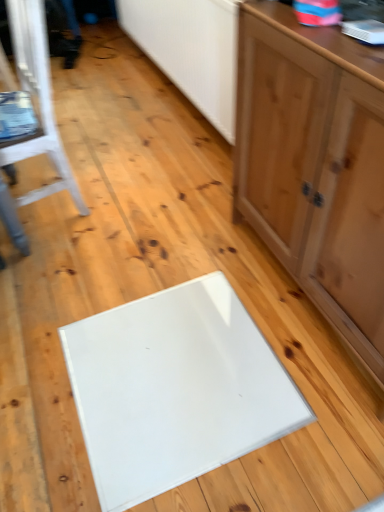
Describe the element at coordinates (315, 165) in the screenshot. The width and height of the screenshot is (384, 512). I see `matte wood cabinet at right` at that location.

The height and width of the screenshot is (512, 384). Identify the location of matte wood cabinet at right. (315, 165).

The height and width of the screenshot is (512, 384). Describe the element at coordinates (38, 101) in the screenshot. I see `white painted wood chair at left` at that location.

This screenshot has height=512, width=384. Identify the location of white painted wood chair at left. pos(38,101).

Where is `matte wood cabinet at right`? The height and width of the screenshot is (512, 384). matte wood cabinet at right is located at coordinates (315, 165).

Is white painted wood chair at left at the left side of matte wood cabinet at right?

Indeed, white painted wood chair at left is positioned on the left side of matte wood cabinet at right.

Which object is further away from the camera taking this photo, white painted wood chair at left or matte wood cabinet at right?

Positioned behind is white painted wood chair at left.

Between point (38, 30) and point (329, 248), which one is positioned behind?

The point (38, 30) is more distant.

Consider the image. From the image's perspective, which object appears higher, white painted wood chair at left or matte wood cabinet at right?

white painted wood chair at left, from the image's perspective.

From a real-world perspective, is white painted wood chair at left located beneath matte wood cabinet at right?

Yes, from a real-world perspective, white painted wood chair at left is under matte wood cabinet at right.

Which of these two, white painted wood chair at left or matte wood cabinet at right, is wider?

With larger width is white painted wood chair at left.

Does white painted wood chair at left have a greater height compared to matte wood cabinet at right?

No, white painted wood chair at left is not taller than matte wood cabinet at right.

Which of these two, white painted wood chair at left or matte wood cabinet at right, is bigger?

Bigger between the two is matte wood cabinet at right.

Could matte wood cabinet at right be considered to be inside white painted wood chair at left?

No, white painted wood chair at left does not contain matte wood cabinet at right.

Is white painted wood chair at left not near matte wood cabinet at right?

No, white painted wood chair at left is in close proximity to matte wood cabinet at right.

Could you tell me if white painted wood chair at left is facing matte wood cabinet at right?

No, white painted wood chair at left is not turned towards matte wood cabinet at right.

How different are the orientations of white painted wood chair at left and matte wood cabinet at right in degrees?

They differ by 6.11 degrees in their facing directions.

At what (x,y) coordinates should I click in order to perform the action: click on cabinetry above the white painted wood chair at left (from a real-world perspective). Please return your answer as a coordinate pair (x, y). Looking at the image, I should click on (315, 165).

Does matte wood cabinet at right appear on the right side of white painted wood chair at left?

Correct, you'll find matte wood cabinet at right to the right of white painted wood chair at left.

Is matte wood cabinet at right closer to camera compared to white painted wood chair at left?

Yes.

Does point (341, 306) come in front of point (41, 86)?

Yes, it is in front of point (41, 86).

From the image's perspective, would you say matte wood cabinet at right is shown under white painted wood chair at left?

Yes, from the image's perspective, matte wood cabinet at right is below white painted wood chair at left.

From a real-world perspective, is matte wood cabinet at right located higher than white painted wood chair at left?

Yes, from a real-world perspective, matte wood cabinet at right is on top of white painted wood chair at left.

Between matte wood cabinet at right and white painted wood chair at left, which one has larger width?

white painted wood chair at left.

Who is taller, matte wood cabinet at right or white painted wood chair at left?

With more height is matte wood cabinet at right.

Does matte wood cabinet at right have a smaller size compared to white painted wood chair at left?

No.

Is matte wood cabinet at right inside or outside of white painted wood chair at left?

The correct answer is: outside.

Is matte wood cabinet at right directly adjacent to white painted wood chair at left?

There is a gap between matte wood cabinet at right and white painted wood chair at left.

Is matte wood cabinet at right positioned with its back to white painted wood chair at left?

matte wood cabinet at right is not turned away from white painted wood chair at left.

Measure the distance between matte wood cabinet at right and white painted wood chair at left.

matte wood cabinet at right is 36.75 inches away from white painted wood chair at left.

Identify the location of furniture below the matte wood cabinet at right (from a real-world perspective). (38, 101).

You are a GUI agent. You are given a task and a screenshot of the screen. Output one action in this format:
    pyautogui.click(x=<x>, y=<y>)
    Task: Click on the cabinetry above the white painted wood chair at left (from a real-world perspective)
    This screenshot has width=384, height=512.
    Given the screenshot: What is the action you would take?
    pyautogui.click(x=315, y=165)

This screenshot has height=512, width=384. Find the location of `cabinetry lying in front of the white painted wood chair at left`. cabinetry lying in front of the white painted wood chair at left is located at coordinates (315, 165).